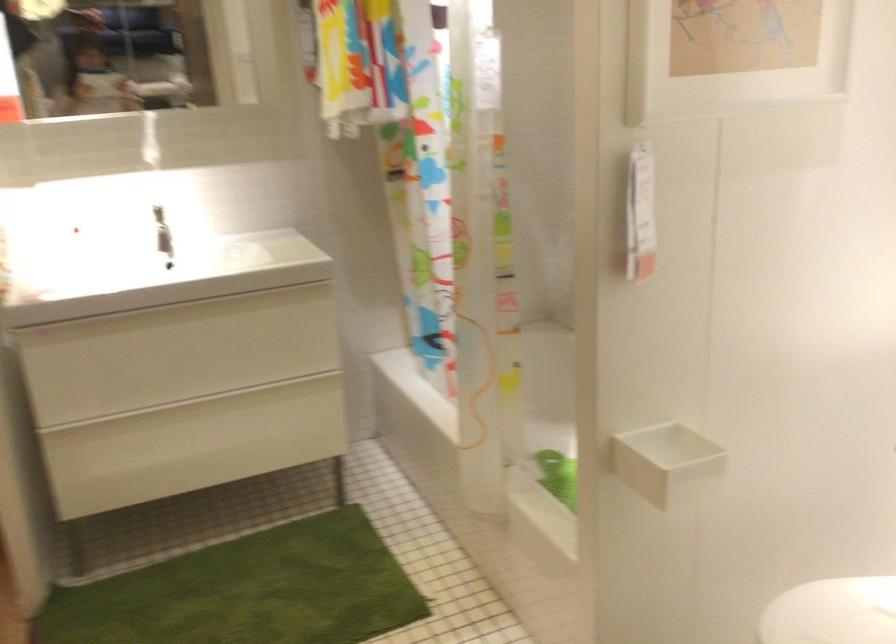
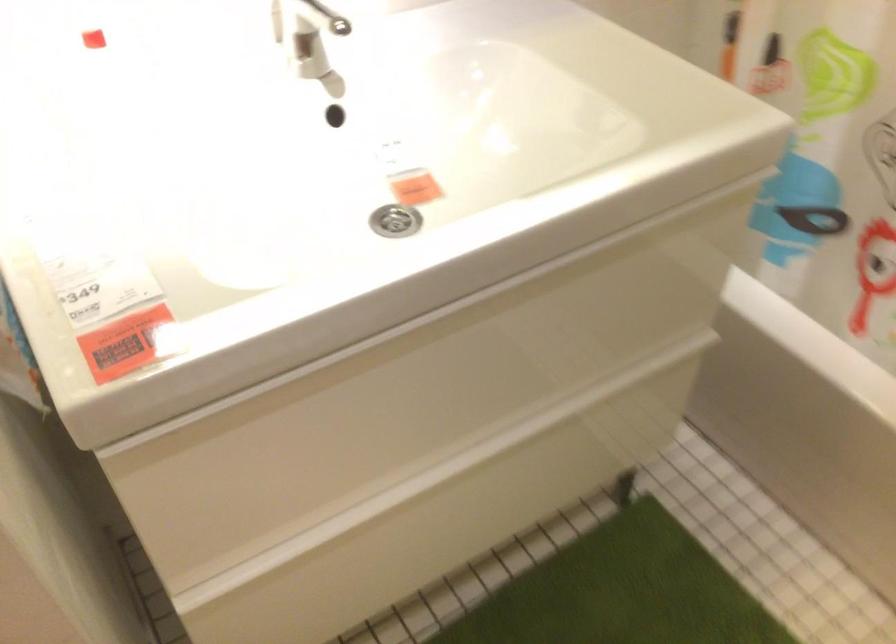
Question: I am providing you with two images of the same scene from different viewpoints. Please identify which objects are invisible in image2.

Choices:
 (A) sink drain stopper
 (B) bottom drawer front
 (C) top drawer front
 (D) none of these

Answer: (D)